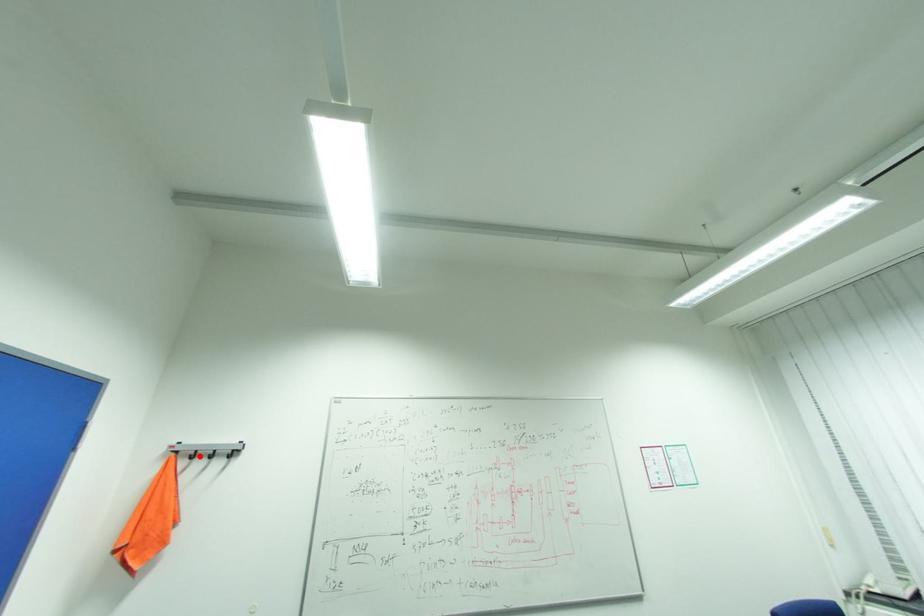
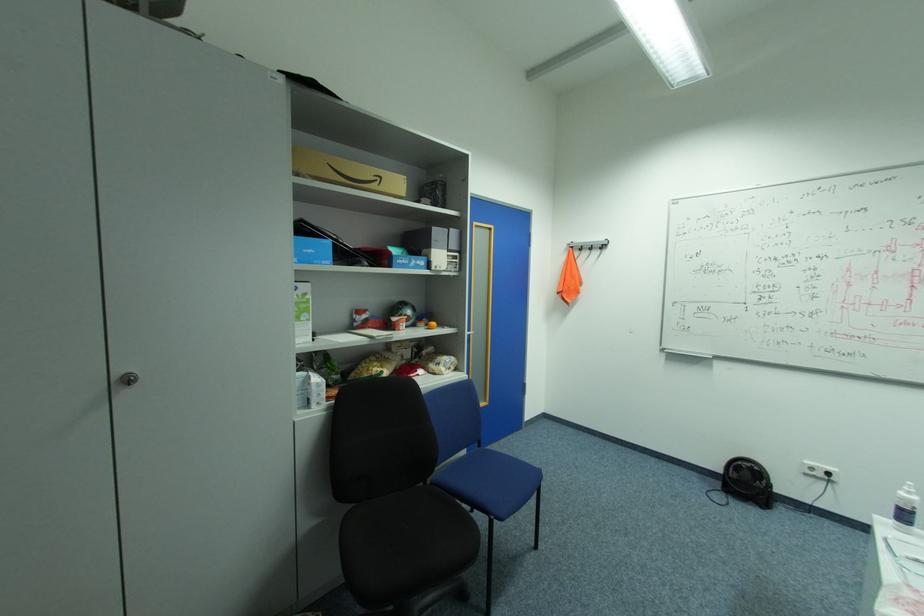
Find the pixel in the second image that matches the highlighted location in the first image.

(588, 249)